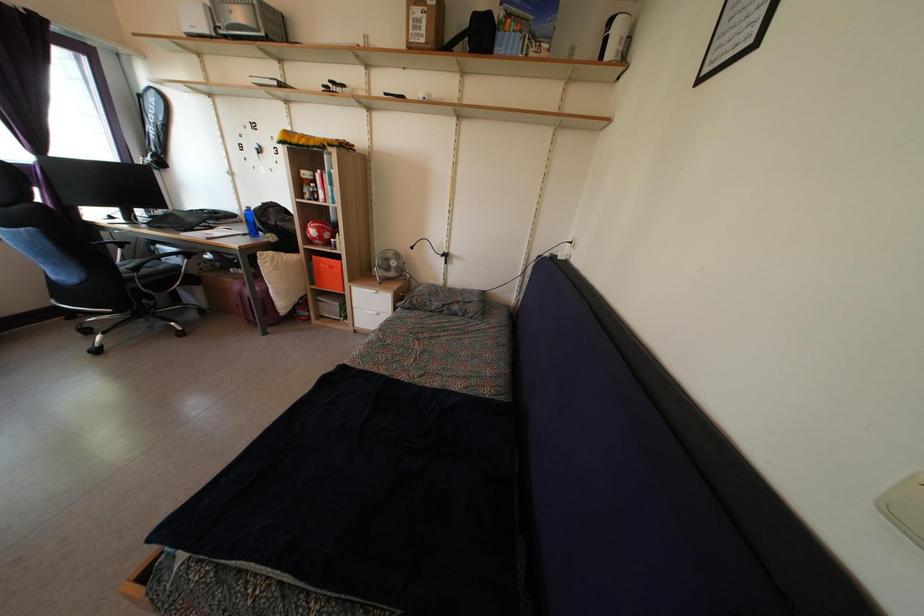
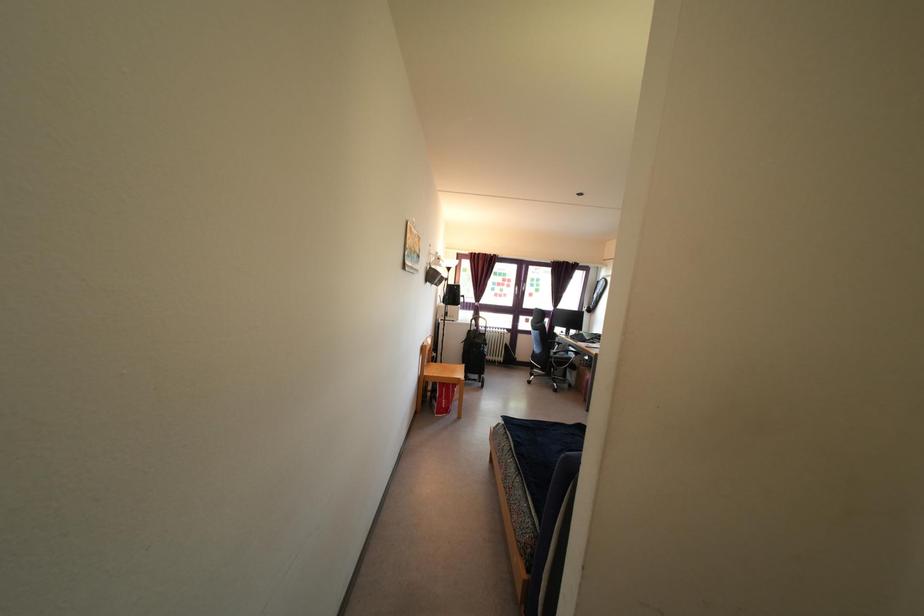
Where in the second image is the point corresponding to the point at 117,220 from the first image?

(566, 338)